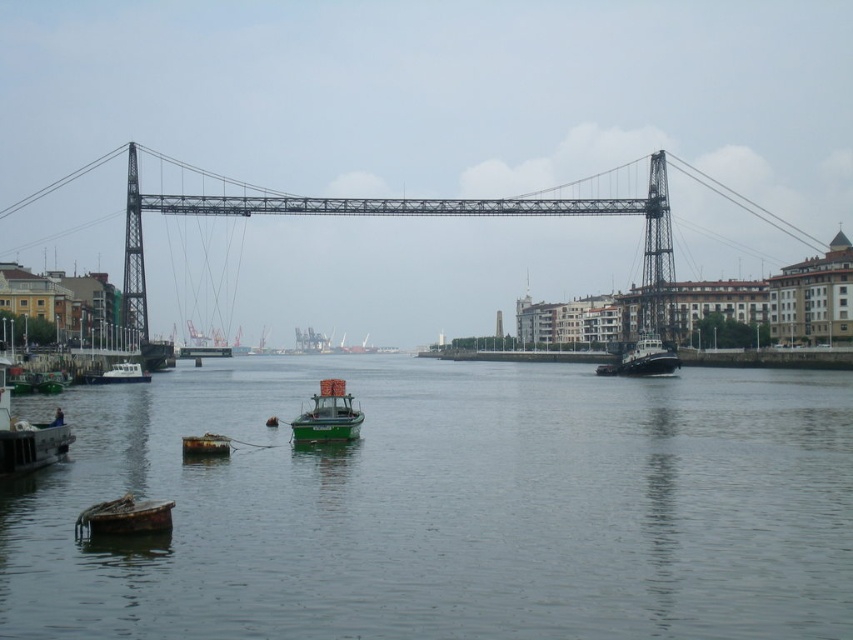
Question: Among these objects, which one is farthest from the camera?

Choices:
 (A) rusty wooden boat at lower left
 (B) metallic bridge at center
 (C) white matte boat at lower left
 (D) green matte tugboat at right

Answer: (B)

Question: Among these objects, which one is nearest to the camera?

Choices:
 (A) green matte water at center
 (B) green matte tugboat at right

Answer: (A)

Question: Does rusty wooden boat at lower left have a greater width compared to rusty metal boat at center?

Choices:
 (A) yes
 (B) no

Answer: (A)

Question: Which point is closer to the camera?

Choices:
 (A) (630, 356)
 (B) (125, 630)

Answer: (B)

Question: Is green matte water at center below rusty wooden boat at lower left?

Choices:
 (A) no
 (B) yes

Answer: (A)

Question: From the image, what is the correct spatial relationship of rusty wooden boat at lower left in relation to rusty metal boat at center?

Choices:
 (A) above
 (B) below

Answer: (B)